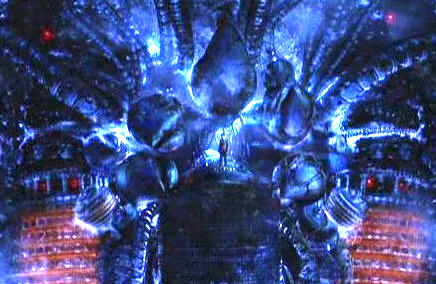
You are a GUI agent. You are given a task and a screenshot of the screen. Output one action in this format:
    pyautogui.click(x=<x>, y=<y>)
    Task: Click on the bright light
    The width and height of the screenshot is (436, 284).
    Given the screenshot: What is the action you would take?
    pyautogui.click(x=151, y=45), pyautogui.click(x=187, y=75), pyautogui.click(x=240, y=121), pyautogui.click(x=249, y=106), pyautogui.click(x=336, y=122), pyautogui.click(x=357, y=144), pyautogui.click(x=212, y=153), pyautogui.click(x=123, y=131), pyautogui.click(x=141, y=203), pyautogui.click(x=154, y=220)